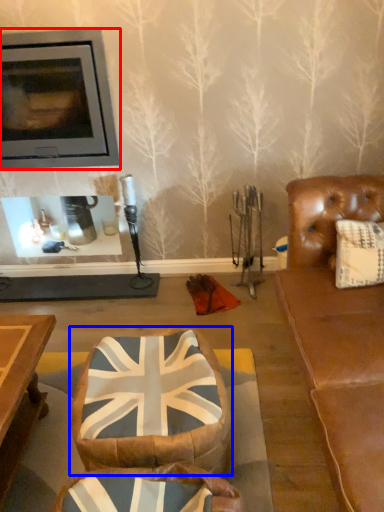
Question: Which object is closer to the camera taking this photo, fireplace (highlighted by a red box) or bean bag chair (highlighted by a blue box)?

Choices:
 (A) fireplace
 (B) bean bag chair

Answer: (B)